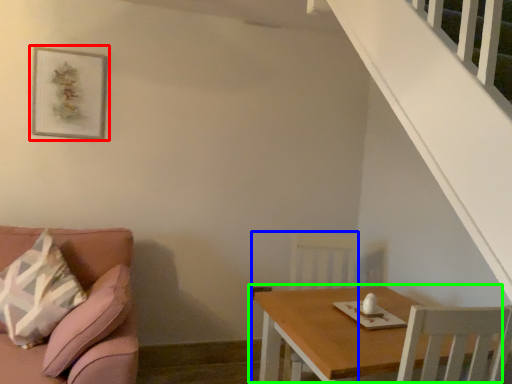
Question: Estimate the real-world distances between objects in this image. Which object is farther from picture frame (highlighted by a red box), armchair (highlighted by a blue box) or table (highlighted by a green box)?

Choices:
 (A) armchair
 (B) table

Answer: (B)